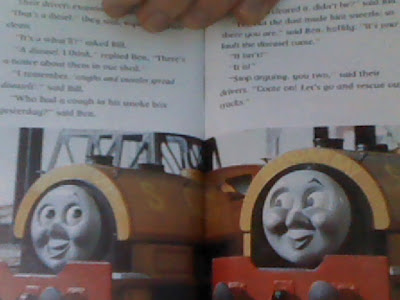
This screenshot has height=300, width=400. Identify the location of book. (250, 102).